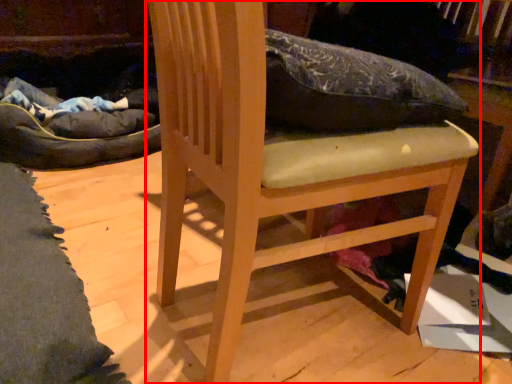
Question: From the image's perspective, considering the relative positions of furniture (annotated by the red box) and cardboard box in the image provided, where is furniture (annotated by the red box) located with respect to the staircase?

Choices:
 (A) above
 (B) below

Answer: (A)